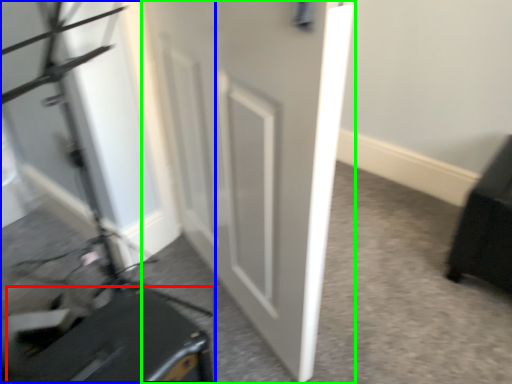
Question: Considering the real-world distances, which object is closest to luggage (highlighted by a red box)? videotape (highlighted by a blue box) or door (highlighted by a green box).

Choices:
 (A) videotape
 (B) door

Answer: (A)